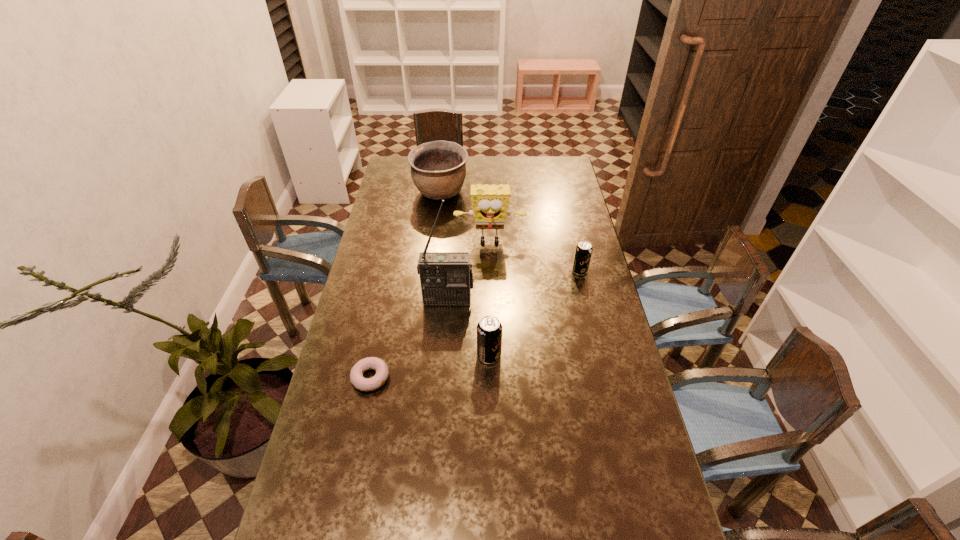
This screenshot has width=960, height=540. I want to click on the third shortest object, so click(x=489, y=329).

Identify the location of the nearer soda can. (489, 329).

The width and height of the screenshot is (960, 540). I want to click on the farther soda can, so click(x=583, y=252).

At what (x,y) coordinates should I click in order to perform the action: click on the rightmost object. Please return your answer as a coordinate pair (x, y). Looking at the image, I should click on (x=583, y=252).

You are a GUI agent. You are given a task and a screenshot of the screen. Output one action in this format:
    pyautogui.click(x=<x>, y=<y>)
    Task: Click on the fourth farthest object
    The height and width of the screenshot is (540, 960).
    Given the screenshot: What is the action you would take?
    pyautogui.click(x=446, y=278)

Where is `the tallest object`? the tallest object is located at coordinates (446, 278).

Locate an element on the screen. Image resolution: width=960 pixels, height=540 pixels. the fourth shortest object is located at coordinates (438, 169).

You are a GUI agent. You are given a task and a screenshot of the screen. Output one action in this format:
    pyautogui.click(x=<x>, y=<y>)
    Task: Click on the pottery
    
    Given the screenshot: What is the action you would take?
    pyautogui.click(x=438, y=169)

Identify the location of sponge. (490, 203).

You are a GUI agent. You are given a task and a screenshot of the screen. Output one action in this format:
    pyautogui.click(x=<x>, y=<y>)
    Task: Click on the fifth nearest object
    This screenshot has width=960, height=540.
    Given the screenshot: What is the action you would take?
    pyautogui.click(x=490, y=203)